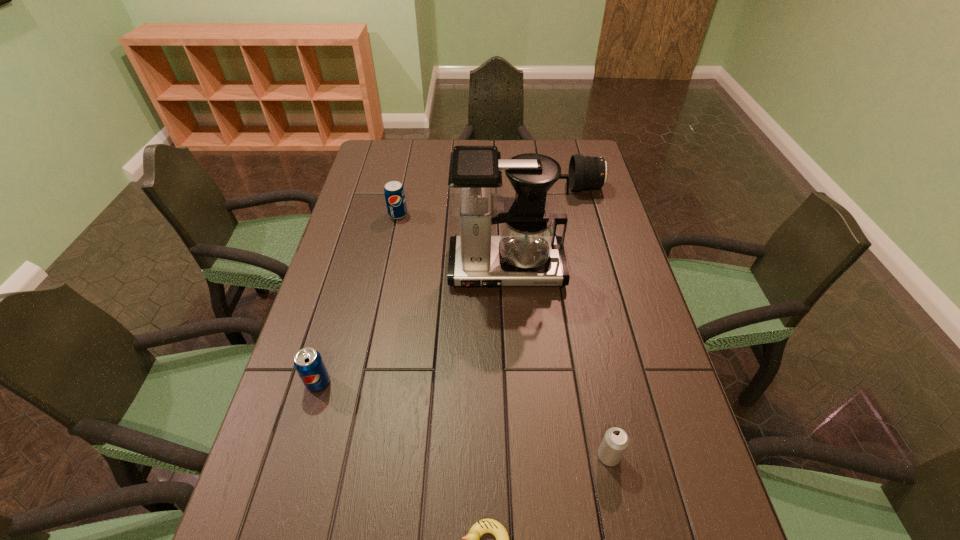
Where is `vacant region between the beer can and the right pop soda`? Image resolution: width=960 pixels, height=540 pixels. vacant region between the beer can and the right pop soda is located at coordinates (503, 335).

You are a GUI agent. You are given a task and a screenshot of the screen. Output one action in this format:
    pyautogui.click(x=<x>, y=<y>)
    Task: Click on the closest object to the shortest object
    
    Given the screenshot: What is the action you would take?
    pyautogui.click(x=615, y=442)

Locate an element on the screen. The image size is (960, 540). object that ranks as the second closest to the nearer pop soda is located at coordinates (483, 526).

Image resolution: width=960 pixels, height=540 pixels. I want to click on vacant space that satisfies the following two spatial constraints: 1. on the front side of the nearer pop soda; 2. on the right side of the second shortest object, so click(x=298, y=456).

Locate an element on the screen. Image resolution: width=960 pixels, height=540 pixels. vacant area in the image that satisfies the following two spatial constraints: 1. at the front element of the rightmost object; 2. on the front side of the beer can is located at coordinates (662, 456).

Find the location of a particular element. The image size is (960, 540). blank space that satisfies the following two spatial constraints: 1. at the front of the beer can where the controls are located; 2. on the left side of the third farthest object is located at coordinates (516, 456).

Find the location of a particular element. free region that satisfies the following two spatial constraints: 1. at the front element of the telephoto lens; 2. on the front side of the second farthest object is located at coordinates (593, 214).